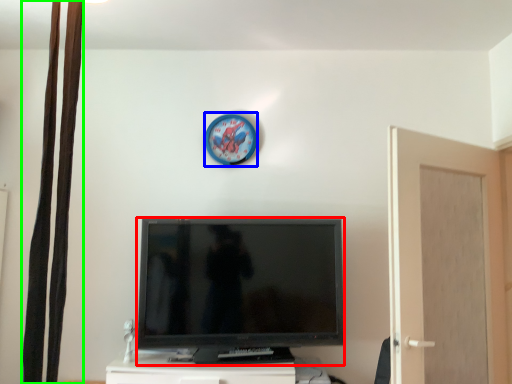
Question: Which object is the closest to the television (highlighted by a red box)? Choose among these: clock (highlighted by a blue box) or curtain (highlighted by a green box).

Choices:
 (A) clock
 (B) curtain

Answer: (A)